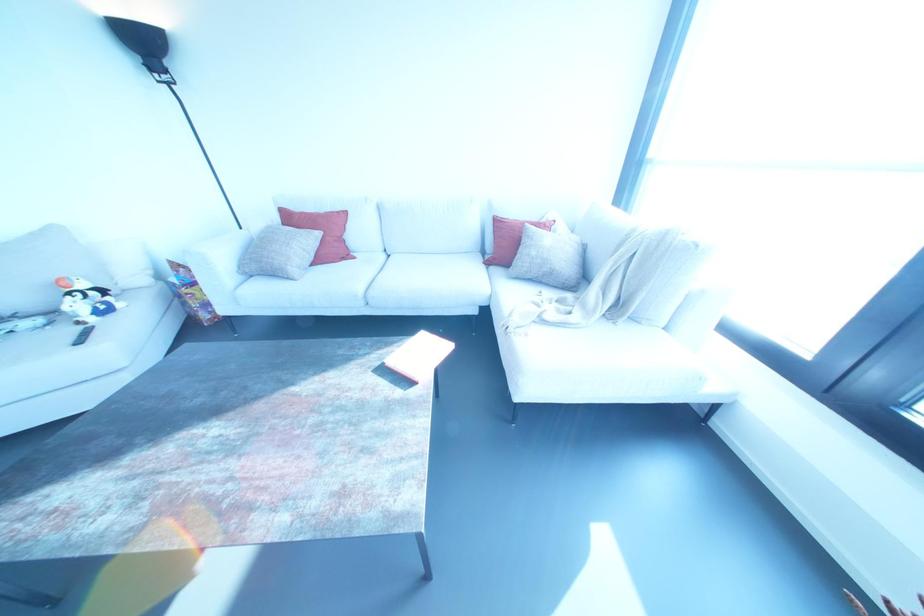
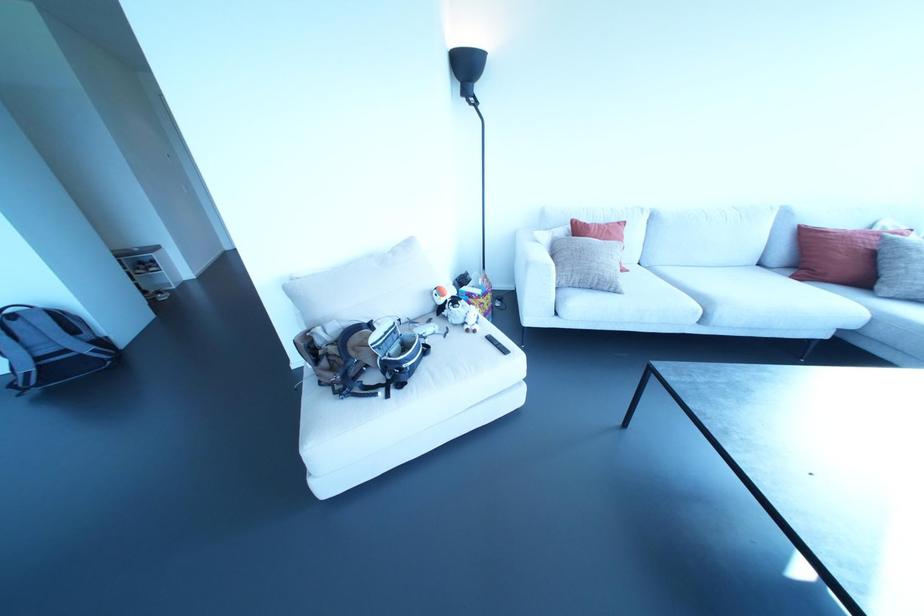
Where in the second image is the point corresponding to point 78,341 from the first image?

(504, 351)